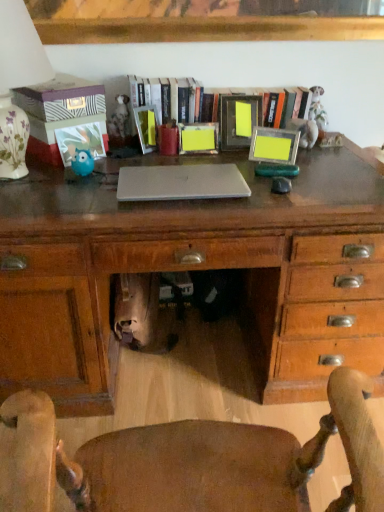
Locate an element on the screen. vacant space that's between satin silver laptop at center and matte blue owl at left, marked as the 2th toy in a back-to-front arrangement is located at coordinates (100, 184).